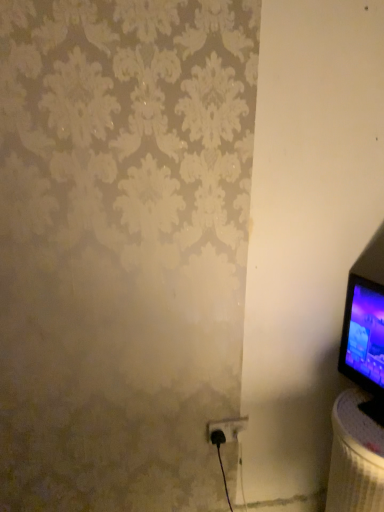
What is the approximate height of black plastic power plug at lower right?

3.86 inches.

Describe the element at coordinates (225, 429) in the screenshot. The height and width of the screenshot is (512, 384). I see `black plastic power plug at lower right` at that location.

At what (x,y) coordinates should I click in order to perform the action: click on black plastic power plug at lower right. Please return your answer as a coordinate pair (x, y). The width and height of the screenshot is (384, 512). Looking at the image, I should click on (225, 429).

What do you see at coordinates (355, 457) in the screenshot?
I see `white textured table at lower right` at bounding box center [355, 457].

Locate an element on the screen. The width and height of the screenshot is (384, 512). white textured table at lower right is located at coordinates (355, 457).

This screenshot has width=384, height=512. In order to click on black plastic power plug at lower right in this screenshot , I will do `click(225, 429)`.

Does black plastic power plug at lower right appear on the right side of white textured table at lower right?

No, black plastic power plug at lower right is not to the right of white textured table at lower right.

Does black plastic power plug at lower right lie behind white textured table at lower right?

Yes, it is behind white textured table at lower right.

Considering the positions of point (209, 435) and point (334, 500), is point (209, 435) closer or farther from the camera than point (334, 500)?

Point (209, 435) is farther from the camera than point (334, 500).

From the image's perspective, which is below, black plastic power plug at lower right or white textured table at lower right?

white textured table at lower right, from the image's perspective.

From a real-world perspective, which object stands above the other?

black plastic power plug at lower right is physically above.

Between black plastic power plug at lower right and white textured table at lower right, which one has larger width?

white textured table at lower right is wider.

Considering the relative sizes of black plastic power plug at lower right and white textured table at lower right in the image provided, is black plastic power plug at lower right taller than white textured table at lower right?

No, black plastic power plug at lower right is not taller than white textured table at lower right.

Considering the sizes of objects black plastic power plug at lower right and white textured table at lower right in the image provided, who is smaller, black plastic power plug at lower right or white textured table at lower right?

black plastic power plug at lower right.

Is black plastic power plug at lower right spatially inside white textured table at lower right, or outside of it?

black plastic power plug at lower right is spatially situated outside white textured table at lower right.

Are black plastic power plug at lower right and white textured table at lower right located far from each other?

No, black plastic power plug at lower right is in close proximity to white textured table at lower right.

Is black plastic power plug at lower right oriented away from white textured table at lower right?

black plastic power plug at lower right does not have its back to white textured table at lower right.

How different are the orientations of black plastic power plug at lower right and white textured table at lower right in degrees?

There is a 92.1-degree angle between the facing directions of black plastic power plug at lower right and white textured table at lower right.

The image size is (384, 512). Identify the location of table on the right of the black plastic power plug at lower right. (355, 457).

Can you confirm if white textured table at lower right is positioned to the left of black plastic power plug at lower right?

No, white textured table at lower right is not to the left of black plastic power plug at lower right.

Considering the positions of objects white textured table at lower right and black plastic power plug at lower right in the image provided, who is in front, white textured table at lower right or black plastic power plug at lower right?

Positioned in front is white textured table at lower right.

Does point (376, 444) lie behind point (214, 430)?

No, it is not.

From the image's perspective, is white textured table at lower right above or below black plastic power plug at lower right?

white textured table at lower right is below black plastic power plug at lower right.

From a real-world perspective, is white textured table at lower right located higher than black plastic power plug at lower right?

Incorrect, from a real-world perspective, white textured table at lower right is lower than black plastic power plug at lower right.

Considering the relative sizes of white textured table at lower right and black plastic power plug at lower right in the image provided, is white textured table at lower right thinner than black plastic power plug at lower right?

In fact, white textured table at lower right might be wider than black plastic power plug at lower right.

Between white textured table at lower right and black plastic power plug at lower right, which one has less height?

black plastic power plug at lower right is shorter.

Does white textured table at lower right have a smaller size compared to black plastic power plug at lower right?

No.

Is white textured table at lower right completely or partially outside of black plastic power plug at lower right?

Yes, white textured table at lower right is outside of black plastic power plug at lower right.

Is there a large distance between white textured table at lower right and black plastic power plug at lower right?

No, there isn't a large distance between white textured table at lower right and black plastic power plug at lower right.

Is white textured table at lower right facing away from black plastic power plug at lower right?

No, white textured table at lower right's orientation is not away from black plastic power plug at lower right.

You are a GUI agent. You are given a task and a screenshot of the screen. Output one action in this format:
    pyautogui.click(x=<x>, y=<y>)
    Task: Click on the table below the black plastic power plug at lower right (from the image's perspective)
    The width and height of the screenshot is (384, 512).
    Given the screenshot: What is the action you would take?
    pyautogui.click(x=355, y=457)

What are the coordinates of `power plugs and sockets behind the white textured table at lower right` in the screenshot? It's located at click(x=225, y=429).

You are a GUI agent. You are given a task and a screenshot of the screen. Output one action in this format:
    pyautogui.click(x=<x>, y=<y>)
    Task: Click on the power plugs and sockets positioned vertically above the white textured table at lower right (from a real-world perspective)
    The width and height of the screenshot is (384, 512).
    Given the screenshot: What is the action you would take?
    pyautogui.click(x=225, y=429)